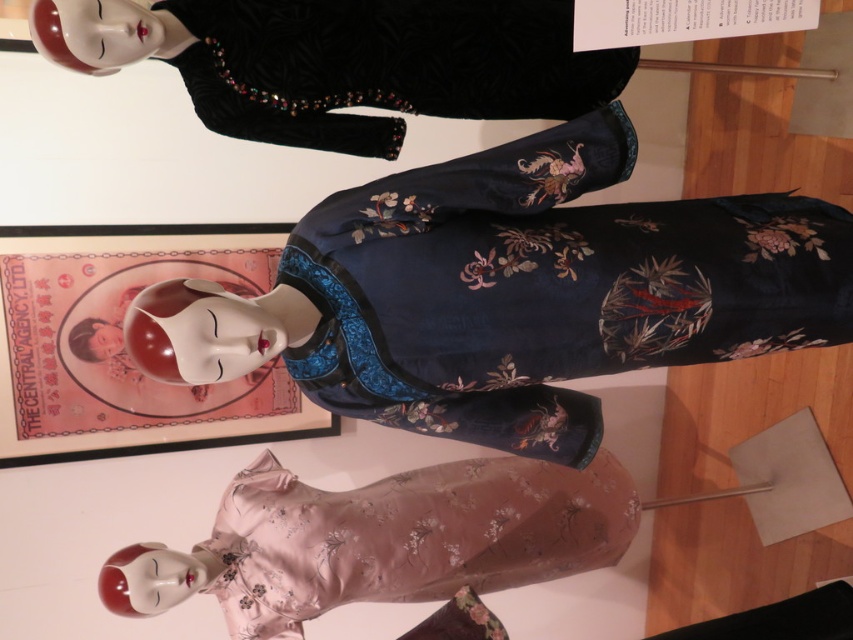
You are a visitor standing in front of the garment display. You notice two points marked in the scene. The first point is at coordinates point (468,385) and the second is at point (292,630). Which point is nearer to you?

Point (468,385) is closer to the camera than point (292,630), so the first point is nearer to you.

You are a museum visitor observing the display of traditional East Asian garments. You notice two dresses in front of you. The navy satin dress at center and the pale pink satin dress at lower center. Which dress is wider?

The navy satin dress at center is wider than the pale pink satin dress at lower center.